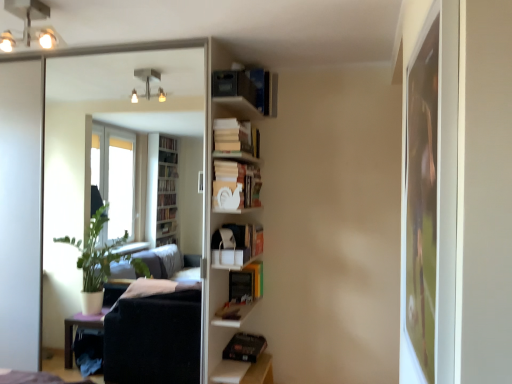
Question: Can you confirm if white matte cat at center, arranged as the 3th book when ordered from the bottom, is shorter than white matte shelf at center?

Choices:
 (A) no
 (B) yes

Answer: (B)

Question: Does white matte cat at center, arranged as the 3th book when ordered from the bottom, come in front of white matte shelf at center?

Choices:
 (A) yes
 (B) no

Answer: (B)

Question: From a real-world perspective, is white matte cat at center, which is the third book in top-to-bottom order, positioned over white matte shelf at center based on gravity?

Choices:
 (A) yes
 (B) no

Answer: (A)

Question: Considering the relative positions of white matte cat at center, arranged as the 3th book when ordered from the bottom, and white matte shelf at center in the image provided, is white matte cat at center, arranged as the 3th book when ordered from the bottom, to the right of white matte shelf at center from the viewer's perspective?

Choices:
 (A) yes
 (B) no

Answer: (A)

Question: From the image's perspective, is white matte cat at center, which is the third book in top-to-bottom order, on white matte shelf at center?

Choices:
 (A) yes
 (B) no

Answer: (A)

Question: Considering the positions of metallic ceiling lights at upper left and hardcover book at center, placed as the 2th book when sorted from bottom to top, in the image, is metallic ceiling lights at upper left bigger or smaller than hardcover book at center, placed as the 2th book when sorted from bottom to top,?

Choices:
 (A) big
 (B) small

Answer: (A)

Question: Is metallic ceiling lights at upper left inside the boundaries of hardcover book at center, the fourth book when ordered from top to bottom, or outside?

Choices:
 (A) outside
 (B) inside

Answer: (A)

Question: In terms of width, does metallic ceiling lights at upper left look wider or thinner when compared to hardcover book at center, the fourth book when ordered from top to bottom?

Choices:
 (A) wide
 (B) thin

Answer: (A)

Question: From the image's perspective, relative to hardcover book at center, placed as the 2th book when sorted from bottom to top, is metallic ceiling lights at upper left above or below?

Choices:
 (A) below
 (B) above

Answer: (B)

Question: From a real-world perspective, is metallic ceiling lights at upper left positioned above or below matte black bookshelf at upper center, acting as the 5th book starting from the bottom?

Choices:
 (A) below
 (B) above

Answer: (B)

Question: Considering the relative positions of metallic ceiling lights at upper left and matte black bookshelf at upper center, acting as the 5th book starting from the bottom, in the image provided, is metallic ceiling lights at upper left to the left or to the right of matte black bookshelf at upper center, acting as the 5th book starting from the bottom,?

Choices:
 (A) right
 (B) left

Answer: (B)

Question: Considering the positions of metallic ceiling lights at upper left and matte black bookshelf at upper center, acting as the 5th book starting from the bottom, in the image, is metallic ceiling lights at upper left wider or thinner than matte black bookshelf at upper center, acting as the 5th book starting from the bottom,?

Choices:
 (A) wide
 (B) thin

Answer: (A)

Question: Considering their positions, is metallic ceiling lights at upper left located in front of or behind matte black bookshelf at upper center, acting as the 5th book starting from the bottom?

Choices:
 (A) front
 (B) behind

Answer: (A)

Question: From the image's perspective, is matte black bookshelf at upper center, which is the 1th book in top-to-bottom order, positioned above or below hardcover book at center, placed as the 2th book when sorted from bottom to top?

Choices:
 (A) above
 (B) below

Answer: (A)

Question: Is matte black bookshelf at upper center, acting as the 5th book starting from the bottom, bigger or smaller than hardcover book at center, the fourth book when ordered from top to bottom?

Choices:
 (A) small
 (B) big

Answer: (B)